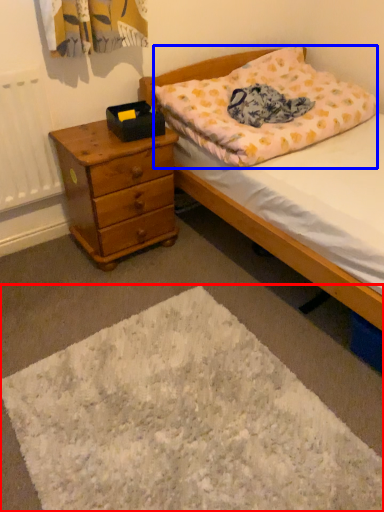
Question: Which object appears closest to the camera in this image, mat (highlighted by a red box) or pillow (highlighted by a blue box)?

Choices:
 (A) mat
 (B) pillow

Answer: (A)